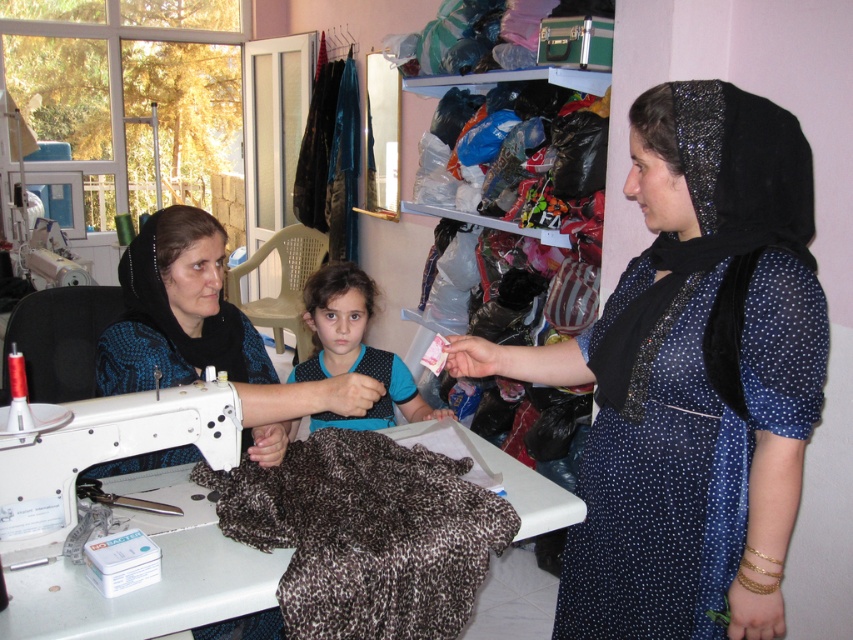
Question: Can you confirm if dark blue dotted dress at center is positioned above white plastic sewing machine at lower left?

Choices:
 (A) no
 (B) yes

Answer: (B)

Question: Is white plastic sewing machine at lower left above brown fuzzy fabric at center?

Choices:
 (A) no
 (B) yes

Answer: (A)

Question: Observing the image, what is the correct spatial positioning of white plastic sewing machine at lower left in reference to brown fuzzy fabric at center?

Choices:
 (A) left
 (B) right

Answer: (A)

Question: Which of these objects is positioned closest to the white plastic sewing machine at lower left?

Choices:
 (A) dark blue dotted dress at center
 (B) brown fuzzy fabric at center

Answer: (B)

Question: Estimate the real-world distances between objects in this image. Which object is farther from the brown fuzzy fabric at center?

Choices:
 (A) dark blue dotted dress at center
 (B) brown fuzzy fabric at lower left

Answer: (A)

Question: Estimate the real-world distances between objects in this image. Which object is closer to the dark blue dotted dress at center?

Choices:
 (A) brown fuzzy fabric at center
 (B) white plastic sewing machine at lower left

Answer: (A)